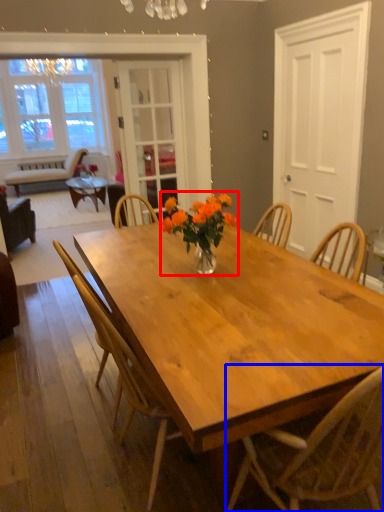
Question: Which point is further to the camera, floral arrangement (highlighted by a red box) or chair (highlighted by a blue box)?

Choices:
 (A) floral arrangement
 (B) chair

Answer: (A)